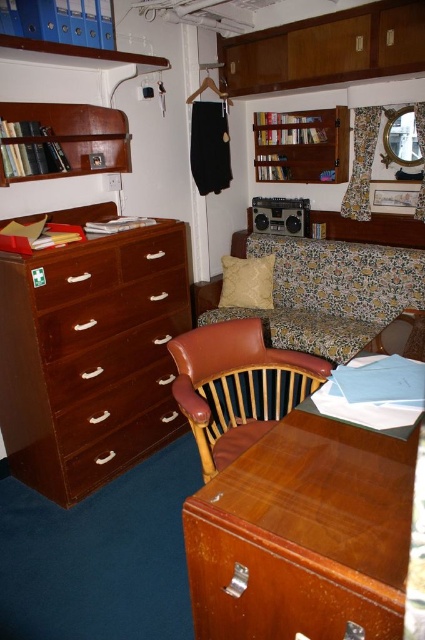
From the picture: You are a guest in this cabin and want to place a small book on the wooden bookshelf at upper left. However, you need to step over the beige fabric pillow at center to reach it. Is the bookshelf above or below the pillow?

The wooden bookshelf at upper left is located above the beige fabric pillow at center, so you can safely step over the pillow to reach the bookshelf.

You are trying to place a beige fabric pillow at center on top of the brown wood drawer at center. Based on the scene described, will the pillow fit without exceeding the drawer in height?

The beige fabric pillow at center has a greater height compared to the brown wood drawer at center, so placing it on top would cause the pillow to exceed the drawer in height.

You are organizing a small office space and need to move a printer from the glossy wood table at lower center to the shiny brown wood file cabinet at left. Since both are in the same room, can you move the printer directly without needing to go around any obstacles?

The glossy wood table at lower center is to the right of the shiny brown wood file cabinet at left, so there is a clear path between them. You can move the printer directly without needing to go around any obstacles.